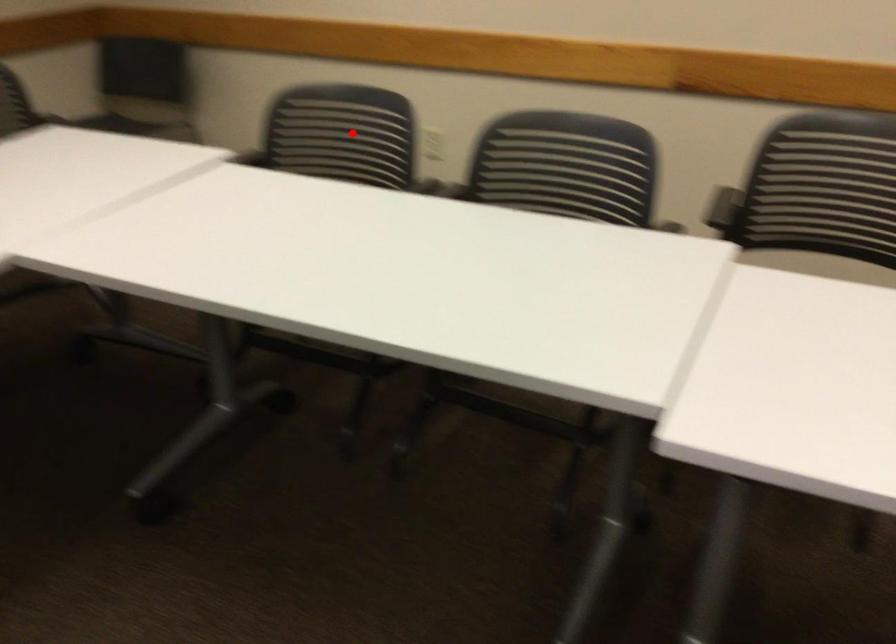
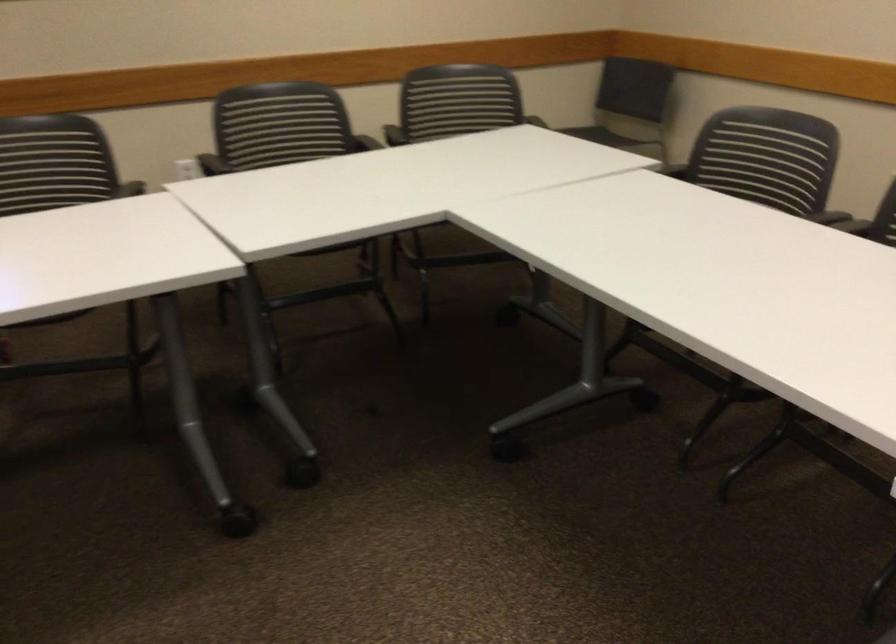
Where in the second image is the point corresponding to the highlighted location from the first image?

(767, 156)